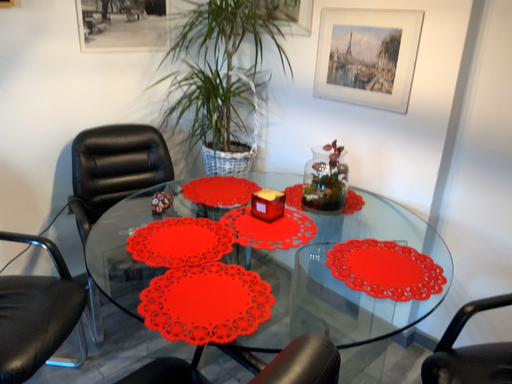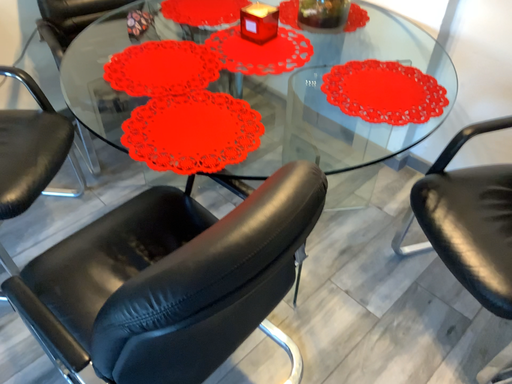
Question: How did the camera likely rotate when shooting the video?

Choices:
 (A) rotated upward
 (B) rotated downward

Answer: (B)